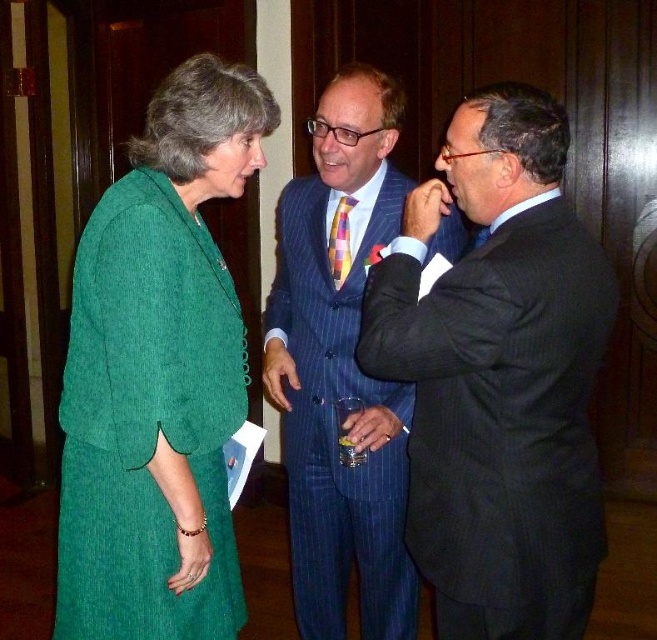
From the picture: You are a photographer at the event and want to take a photo of the dark blue pinstripe suit at center and the multicolored woven tie at center. Which one should be positioned closer to the camera to ensure both are in focus?

The dark blue pinstripe suit at center is in front of the multicolored woven tie at center, so positioning the dark blue pinstripe suit at center closer to the camera will keep both in focus since it is already in front.